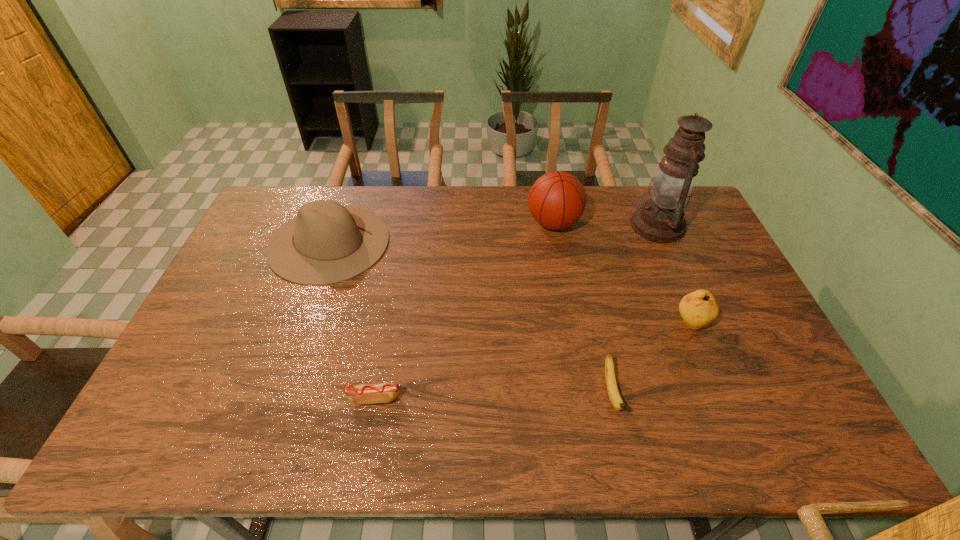
Where is `vacant space that is in between the sombrero and the oil lamp`? vacant space that is in between the sombrero and the oil lamp is located at coordinates (493, 234).

This screenshot has height=540, width=960. Identify the location of free space that is in between the sausage and the fifth tallest object. (492, 396).

Where is `vacant point located between the sausage and the oil lamp`? This screenshot has height=540, width=960. vacant point located between the sausage and the oil lamp is located at coordinates (516, 312).

Identify the location of free spot between the sombrero and the banana. This screenshot has height=540, width=960. (469, 318).

You are a GUI agent. You are given a task and a screenshot of the screen. Output one action in this format:
    pyautogui.click(x=<x>, y=<y>)
    Task: Click on the free space between the second shortest object and the oil lamp
    This screenshot has width=960, height=540.
    Given the screenshot: What is the action you would take?
    pyautogui.click(x=635, y=309)

Select which object is the closest to the second tallest object. Please provide its 2D coordinates. Your answer should be formatted as a tuple, i.e. [(x, y)], where the tuple contains the x and y coordinates of a point satisfying the conditions above.

[(661, 219)]

At what (x,y) coordinates should I click in order to perform the action: click on object identified as the fifth closest to the basketball. Please return your answer as a coordinate pair (x, y). Image resolution: width=960 pixels, height=540 pixels. Looking at the image, I should click on (385, 392).